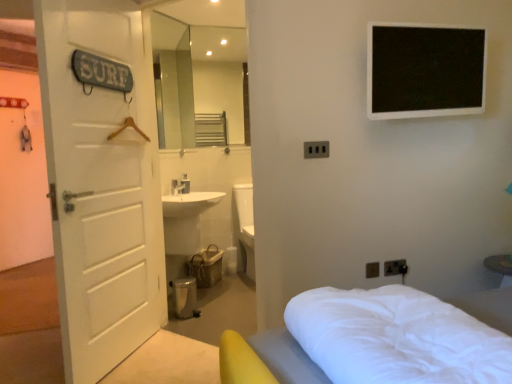
Question: Is matte black electric outlet at lower right, placed as the 2th electric outlet when sorted from right to left, wider than black plastic electrical outlet at lower right, which is the first electric outlet from right to left?

Choices:
 (A) yes
 (B) no

Answer: (A)

Question: Is the position of matte black electric outlet at lower right, which is counted as the 1th electric outlet, starting from the bottom, less distant than that of black plastic electrical outlet at lower right, acting as the 3th electric outlet starting from the left?

Choices:
 (A) yes
 (B) no

Answer: (A)

Question: Considering the relative sizes of matte black electric outlet at lower right, placed as the 2th electric outlet when sorted from right to left, and black plastic electrical outlet at lower right, the 1th electric outlet in the back-to-front sequence, in the image provided, is matte black electric outlet at lower right, placed as the 2th electric outlet when sorted from right to left, taller than black plastic electrical outlet at lower right, the 1th electric outlet in the back-to-front sequence,?

Choices:
 (A) no
 (B) yes

Answer: (B)

Question: Can you confirm if matte black electric outlet at lower right, which ranks as the 2th electric outlet in left-to-right order, is positioned to the right of black plastic electrical outlet at lower right, the 1th electric outlet in the back-to-front sequence?

Choices:
 (A) yes
 (B) no

Answer: (B)

Question: From the image's perspective, is matte black electric outlet at lower right, placed as the 2th electric outlet when sorted from right to left, on top of black plastic electrical outlet at lower right, the third electric outlet viewed from the front?

Choices:
 (A) yes
 (B) no

Answer: (B)

Question: Could you tell me if matte black electric outlet at lower right, placed as the 2th electric outlet when sorted from right to left, is turned towards black plastic electrical outlet at lower right, which ranks as the 2th electric outlet in top-to-bottom order?

Choices:
 (A) no
 (B) yes

Answer: (A)

Question: Is matte black electric outlet at lower right, which ranks as the 2th electric outlet in left-to-right order, taller than white soft bed at lower right?

Choices:
 (A) no
 (B) yes

Answer: (A)

Question: Is matte black electric outlet at lower right, which ranks as the 2th electric outlet in left-to-right order, at the left side of white soft bed at lower right?

Choices:
 (A) no
 (B) yes

Answer: (A)

Question: Considering the relative sizes of matte black electric outlet at lower right, placed as the 2th electric outlet when sorted from right to left, and white soft bed at lower right in the image provided, is matte black electric outlet at lower right, placed as the 2th electric outlet when sorted from right to left, shorter than white soft bed at lower right?

Choices:
 (A) yes
 (B) no

Answer: (A)

Question: Can white soft bed at lower right be found inside matte black electric outlet at lower right, placed as the 2th electric outlet when sorted from right to left?

Choices:
 (A) no
 (B) yes

Answer: (A)

Question: Would you say matte black electric outlet at lower right, which ranks as the third electric outlet in top-to-bottom order, is outside white soft bed at lower right?

Choices:
 (A) yes
 (B) no

Answer: (A)

Question: Does matte black electric outlet at lower right, which ranks as the 2th electric outlet in left-to-right order, turn towards white soft bed at lower right?

Choices:
 (A) no
 (B) yes

Answer: (B)

Question: From a real-world perspective, is white soft bed at lower right beneath black plastic electric outlet at center, the first electric outlet in the front-to-back sequence?

Choices:
 (A) yes
 (B) no

Answer: (A)